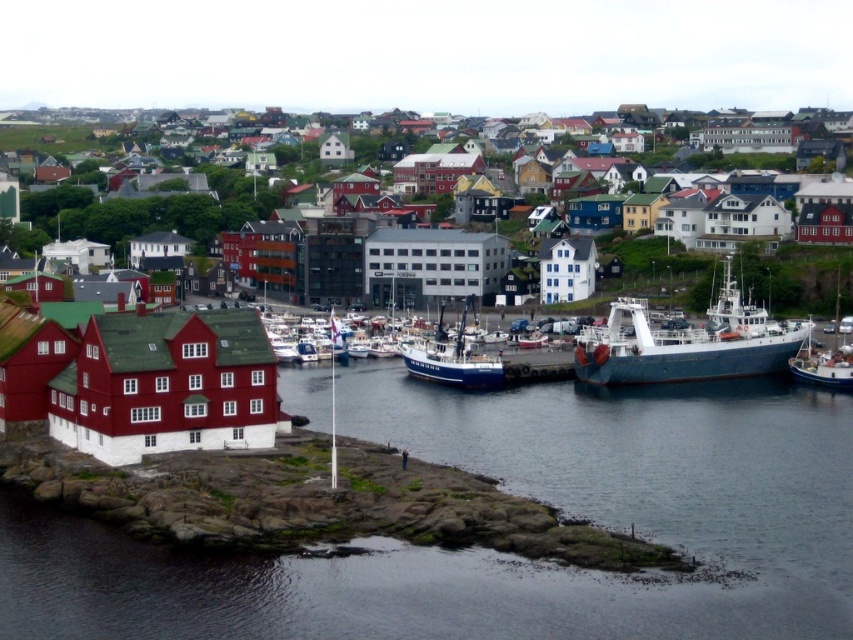
Question: Can you confirm if blue metallic ship at lower right is positioned below blue matte boat at center?

Choices:
 (A) no
 (B) yes

Answer: (A)

Question: Observing the image, what is the correct spatial positioning of blue matte boat at center in reference to blue metallic boat at right?

Choices:
 (A) below
 (B) above

Answer: (B)

Question: Which point is farther to the camera?

Choices:
 (A) (485, 214)
 (B) (842, 346)

Answer: (A)

Question: Which object is positioned closest to the blue matte boat at center?

Choices:
 (A) blue metallic ship at lower right
 (B) matte red building at center
 (C) blue metallic boat at right

Answer: (A)

Question: Does matte red building at center have a smaller size compared to blue metallic boat at right?

Choices:
 (A) no
 (B) yes

Answer: (A)

Question: Estimate the real-world distances between objects in this image. Which object is closer to the blue metallic ship at lower right?

Choices:
 (A) blue metallic boat at right
 (B) matte red building at center
 (C) blue matte boat at center

Answer: (A)